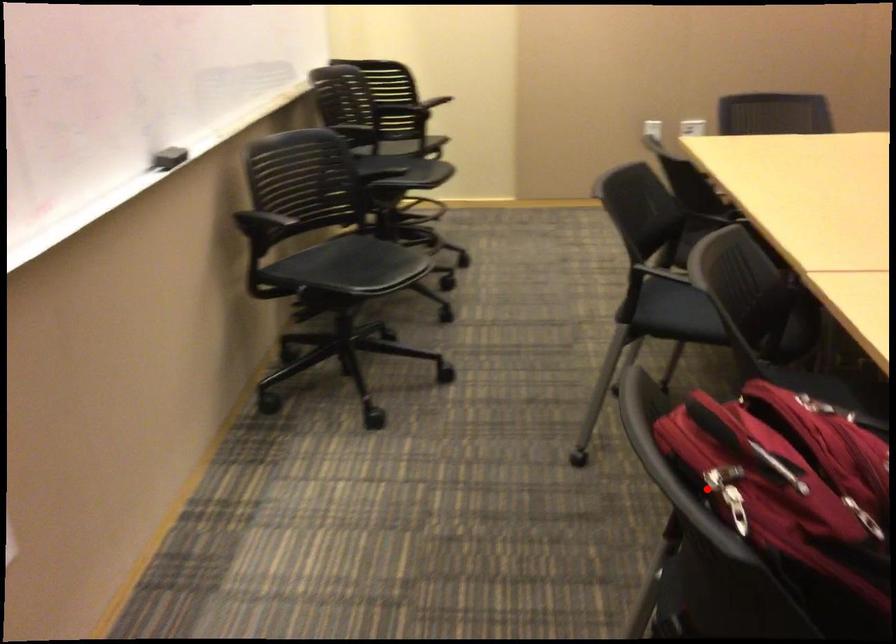
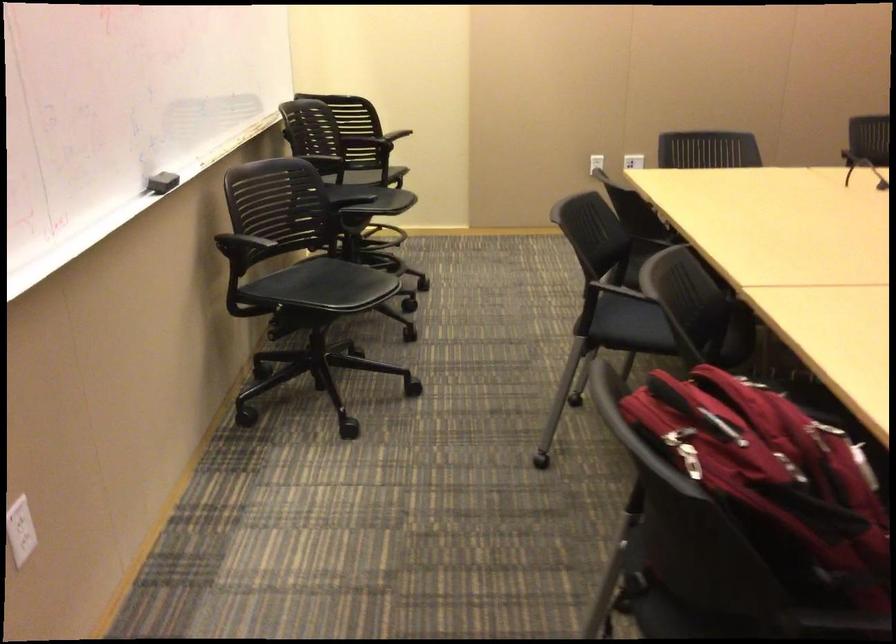
Question: I am providing you with two images of the same scene from different viewpoints. A red point is marked on the first image. At the location where the point appears in image 1, is it still visible in image 2?

Choices:
 (A) Yes
 (B) No

Answer: (A)